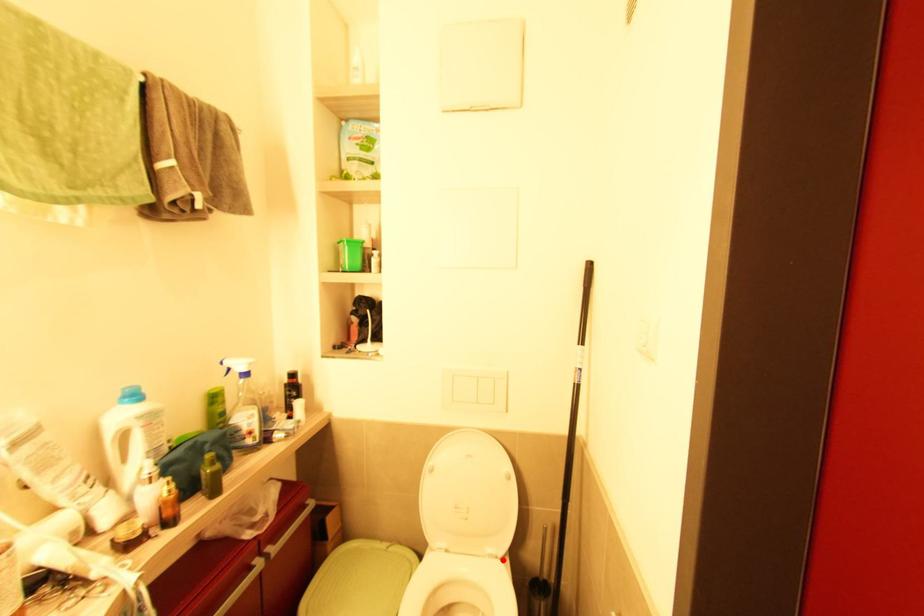
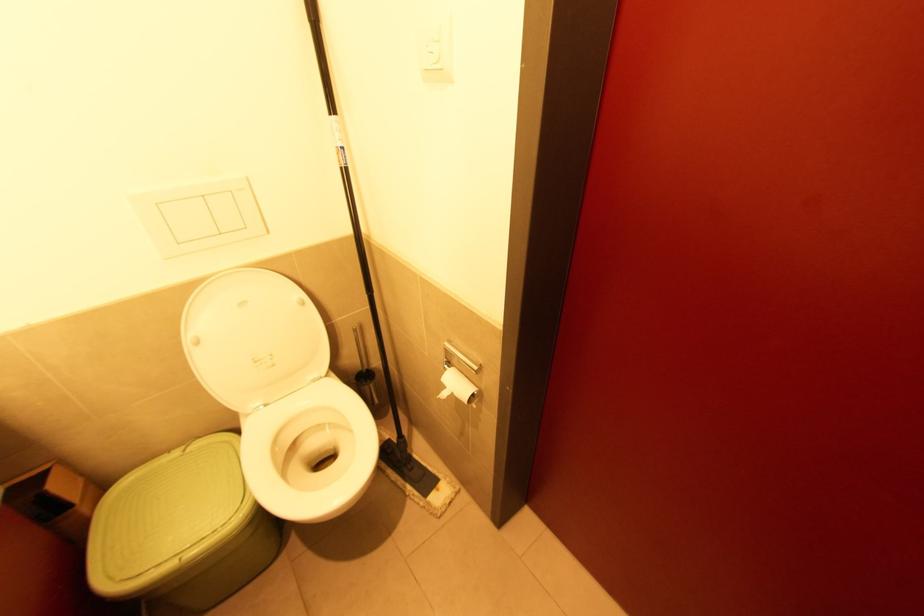
Locate, in the second image, the point that corresponds to the highlighted location in the first image.

(329, 377)